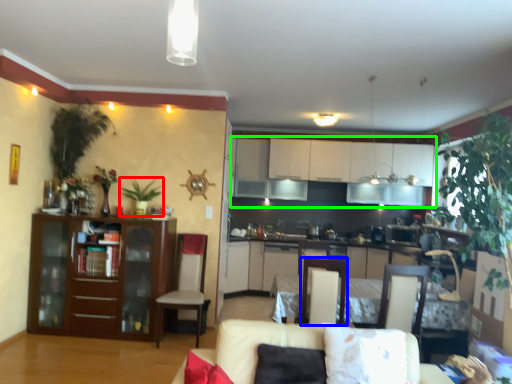
Question: Which object is positioned closest to plant (highlighted by a red box)? Select from armchair (highlighted by a blue box) and cabinetry (highlighted by a green box).

Choices:
 (A) armchair
 (B) cabinetry

Answer: (A)